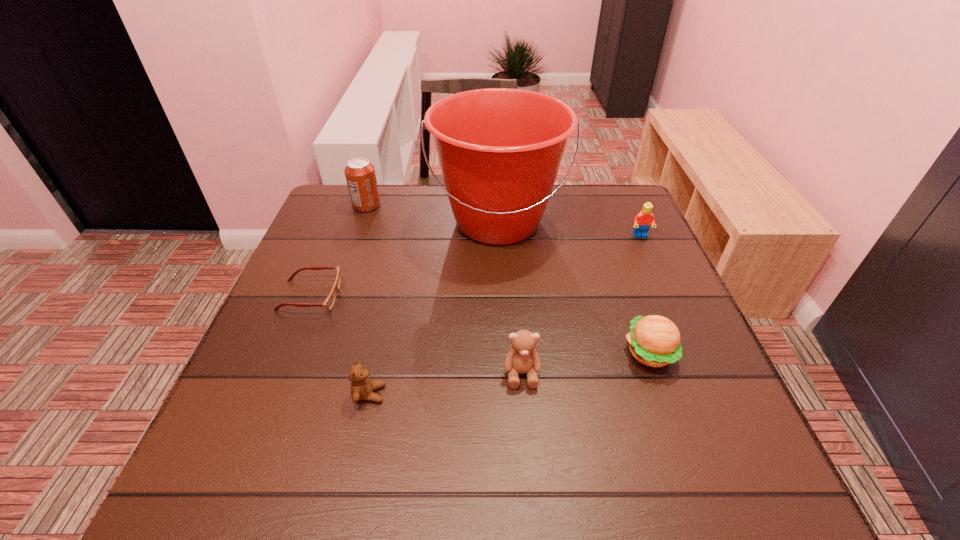
Find the location of a particular element. The width and height of the screenshot is (960, 540). bucket is located at coordinates point(500,149).

Identify the location of the second tallest object. The image size is (960, 540). (360, 175).

At what (x,y) coordinates should I click in order to perform the action: click on the rightmost object. Please return your answer as a coordinate pair (x, y). Looking at the image, I should click on (642, 222).

What are the coordinates of `the right teddy bear` in the screenshot? It's located at (522, 358).

Image resolution: width=960 pixels, height=540 pixels. Identify the location of the second object from right to left. (654, 340).

Where is `the fifth object from right to left`? The height and width of the screenshot is (540, 960). the fifth object from right to left is located at coordinates (362, 387).

The image size is (960, 540). I want to click on the left teddy bear, so click(362, 387).

Locate an element on the screen. This screenshot has width=960, height=540. spectacles is located at coordinates (329, 302).

This screenshot has height=540, width=960. I want to click on the shortest object, so click(x=329, y=302).

Where is `free space located with the handle attached to the rim of the bucket`? free space located with the handle attached to the rim of the bucket is located at coordinates (504, 354).